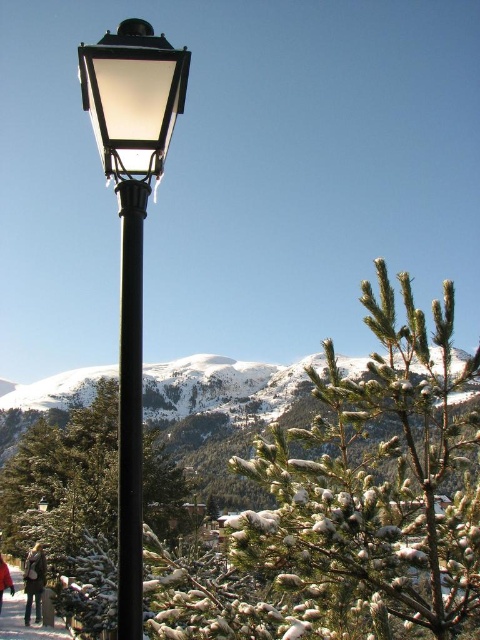
Between matte black pole at lower left and light brown leather jacket at lower left, which one appears on the right side from the viewer's perspective?

From the viewer's perspective, light brown leather jacket at lower left appears more on the right side.

Between matte black pole at lower left and light brown leather jacket at lower left, which one has less height?

matte black pole at lower left is shorter.

Which is behind, point (58, 621) or point (37, 589)?

The point (37, 589) is more distant.

Image resolution: width=480 pixels, height=640 pixels. Find the location of `matte black pole at lower left`. matte black pole at lower left is located at coordinates (23, 616).

Find the location of a particular element. matte black pole at lower left is located at coordinates (23, 616).

Can you confirm if matte black pole at lower left is taller than red woolen coat at lower left?

No, matte black pole at lower left is not taller than red woolen coat at lower left.

At what (x,y) coordinates should I click in order to perform the action: click on matte black pole at lower left. Please return your answer as a coordinate pair (x, y). This screenshot has height=640, width=480. Looking at the image, I should click on (23, 616).

Where is `matte black pole at lower left`? The width and height of the screenshot is (480, 640). matte black pole at lower left is located at coordinates (23, 616).

Does matte black street light at left have a lesser height compared to red woolen coat at lower left?

No.

Is matte black street light at left wider than red woolen coat at lower left?

Correct, the width of matte black street light at left exceeds that of red woolen coat at lower left.

Is point (129, 134) behind point (13, 586)?

No, (129, 134) is closer to viewer.

You are a GUI agent. You are given a task and a screenshot of the screen. Output one action in this format:
    pyautogui.click(x=<x>, y=<y>)
    Task: Click on the matte black street light at left
    Image resolution: width=480 pixels, height=640 pixels.
    Given the screenshot: What is the action you would take?
    pyautogui.click(x=132, y=237)